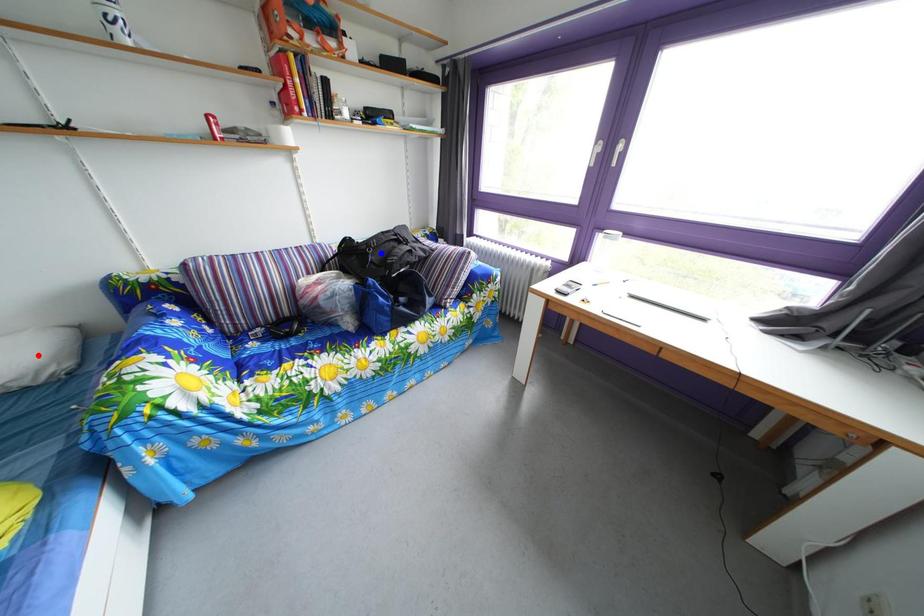
Question: Which of the two points in the image is closer to the camera?

Choices:
 (A) Blue point is closer.
 (B) Red point is closer.

Answer: (B)